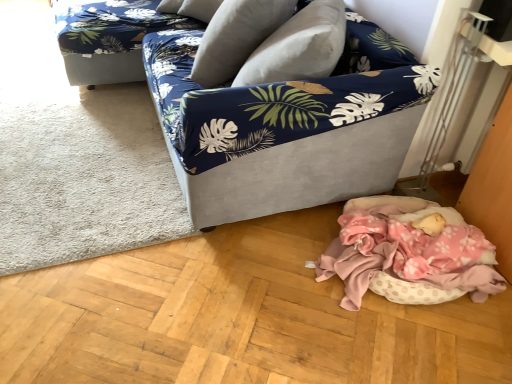
What do you see at coordinates (409, 253) in the screenshot?
I see `pink polka dot fabric at lower right` at bounding box center [409, 253].

This screenshot has width=512, height=384. I want to click on blue floral fabric couch at upper left, so click(x=110, y=37).

What is the approximate width of velvet-like beige pillow at upper center?

It is 18.59 inches.

The height and width of the screenshot is (384, 512). Describe the element at coordinates (236, 37) in the screenshot. I see `velvet-like beige pillow at upper center` at that location.

Locate an element on the screen. white soft rug at lower left is located at coordinates (84, 179).

Considering their positions, is blue floral fabric couch at upper left located in front of or behind velvet-like beige pillow at upper center?

blue floral fabric couch at upper left is positioned farther from the viewer than velvet-like beige pillow at upper center.

Are blue floral fabric couch at upper left and velvet-like beige pillow at upper center located far from each other?

No, blue floral fabric couch at upper left is in close proximity to velvet-like beige pillow at upper center.

From a real-world perspective, relative to velvet-like beige pillow at upper center, is blue floral fabric couch at upper left vertically above or below?

In terms of real-world spatial position, blue floral fabric couch at upper left is below velvet-like beige pillow at upper center.

Looking at this image, considering the relative sizes of blue floral fabric couch at upper left and velvet-like beige pillow at upper center in the image provided, is blue floral fabric couch at upper left thinner than velvet-like beige pillow at upper center?

No.

In order to click on couch above the white soft rug at lower left (from the image's perspective) in this screenshot , I will do `click(110, 37)`.

Which object is wider, blue floral fabric couch at upper left or white soft rug at lower left?

blue floral fabric couch at upper left is wider.

Considering the points (93, 81) and (51, 264), which point is in front, point (93, 81) or point (51, 264)?

Point (51, 264)

Considering the sizes of objects blue floral fabric couch at upper left and velvet fabric couch at center in the image provided, who is taller, blue floral fabric couch at upper left or velvet fabric couch at center?

velvet fabric couch at center.

Who is smaller, blue floral fabric couch at upper left or velvet fabric couch at center?

blue floral fabric couch at upper left is smaller.

Is point (79, 15) positioned after point (180, 38)?

Yes, point (79, 15) is farther from viewer.

Considering the sizes of objects blue floral fabric couch at upper left and velvet fabric couch at center in the image provided, who is thinner, blue floral fabric couch at upper left or velvet fabric couch at center?

Thinner between the two is velvet fabric couch at center.

Which is in front, velvet fabric couch at center or velvet-like beige pillow at upper center?

Positioned in front is velvet fabric couch at center.

From a real-world perspective, is velvet fabric couch at center positioned above or below velvet-like beige pillow at upper center?

In terms of real-world spatial position, velvet fabric couch at center is below velvet-like beige pillow at upper center.

Can we say velvet fabric couch at center lies outside velvet-like beige pillow at upper center?

Absolutely, velvet fabric couch at center is external to velvet-like beige pillow at upper center.

Can you tell me how much velvet fabric couch at center and velvet-like beige pillow at upper center differ in facing direction?

velvet fabric couch at center and velvet-like beige pillow at upper center are facing 30.1 degrees away from each other.

Considering the positions of objects pink polka dot fabric at lower right and white soft rug at lower left in the image provided, who is more to the right, pink polka dot fabric at lower right or white soft rug at lower left?

pink polka dot fabric at lower right.

In the image, is pink polka dot fabric at lower right positioned in front of or behind white soft rug at lower left?

pink polka dot fabric at lower right is positioned closer to the viewer than white soft rug at lower left.

From the image's perspective, is pink polka dot fabric at lower right above or below white soft rug at lower left?

pink polka dot fabric at lower right is situated lower than white soft rug at lower left in the image.

Is point (398, 229) positioned behind point (18, 108)?

No.

In terms of height, does white soft rug at lower left look taller or shorter compared to velvet-like beige pillow at upper center?

white soft rug at lower left is shorter than velvet-like beige pillow at upper center.

Considering the points (161, 229) and (231, 60), which point is in front, point (161, 229) or point (231, 60)?

The point (161, 229) is more forward.

Which of these two, white soft rug at lower left or velvet-like beige pillow at upper center, is wider?

white soft rug at lower left.

Which is more to the left, velvet-like beige pillow at upper center or velvet fabric couch at center?

Positioned to the left is velvet-like beige pillow at upper center.

Is velvet-like beige pillow at upper center thinner than velvet fabric couch at center?

Yes.

Looking at this image, are velvet-like beige pillow at upper center and velvet fabric couch at center beside each other?

No, velvet-like beige pillow at upper center is not making contact with velvet fabric couch at center.

Considering the positions of objects velvet-like beige pillow at upper center and velvet fabric couch at center in the image provided, who is in front, velvet-like beige pillow at upper center or velvet fabric couch at center?

velvet fabric couch at center is more forward.

Locate an element on the screen. This screenshot has height=384, width=512. pillow lying in front of the blue floral fabric couch at upper left is located at coordinates (236, 37).

You are a GUI agent. You are given a task and a screenshot of the screen. Output one action in this format:
    pyautogui.click(x=<x>, y=<y>)
    Task: Click on the couch above the white soft rug at lower left (from the image's perspective)
    The image size is (512, 384).
    Given the screenshot: What is the action you would take?
    pyautogui.click(x=110, y=37)

From the picture: Looking at the image, which one is located closer to blue floral fabric couch at upper left, velvet fabric couch at center or white soft rug at lower left?

The object closer to blue floral fabric couch at upper left is white soft rug at lower left.

Based on their spatial positions, is white soft rug at lower left or velvet fabric couch at center closer to pink polka dot fabric at lower right?

velvet fabric couch at center is positioned closer to the anchor pink polka dot fabric at lower right.

Consider the image. Considering their positions, is velvet fabric couch at center positioned further to white soft rug at lower left than pink polka dot fabric at lower right?

The object further to white soft rug at lower left is pink polka dot fabric at lower right.

Which object lies further to the anchor point velvet-like beige pillow at upper center, blue floral fabric couch at upper left or pink polka dot fabric at lower right?

Based on the image, pink polka dot fabric at lower right appears to be further to velvet-like beige pillow at upper center.

Looking at the image, which one is located further to pink polka dot fabric at lower right, velvet fabric couch at center or white soft rug at lower left?

white soft rug at lower left is further to pink polka dot fabric at lower right.

Considering their positions, is velvet-like beige pillow at upper center positioned closer to blue floral fabric couch at upper left than velvet fabric couch at center?

velvet fabric couch at center is closer to blue floral fabric couch at upper left.

Which object lies further to the anchor point pink polka dot fabric at lower right, white soft rug at lower left or blue floral fabric couch at upper left?

blue floral fabric couch at upper left is further to pink polka dot fabric at lower right.

Estimate the real-world distances between objects in this image. Which object is further from velvet fabric couch at center, blue floral fabric couch at upper left or white soft rug at lower left?

blue floral fabric couch at upper left is positioned further to the anchor velvet fabric couch at center.

Identify the location of pillow between velvet fabric couch at center and blue floral fabric couch at upper left along the z-axis. (236, 37).

You are a GUI agent. You are given a task and a screenshot of the screen. Output one action in this format:
    pyautogui.click(x=<x>, y=<y>)
    Task: Click on the couch between white soft rug at lower left and velvet-like beige pillow at upper center
    The image size is (512, 384).
    Given the screenshot: What is the action you would take?
    pyautogui.click(x=110, y=37)

The image size is (512, 384). I want to click on mat between velvet fabric couch at center and blue floral fabric couch at upper left along the z-axis, so click(x=84, y=179).

Locate an element on the screen. couch between white soft rug at lower left and pink polka dot fabric at lower right is located at coordinates (110, 37).